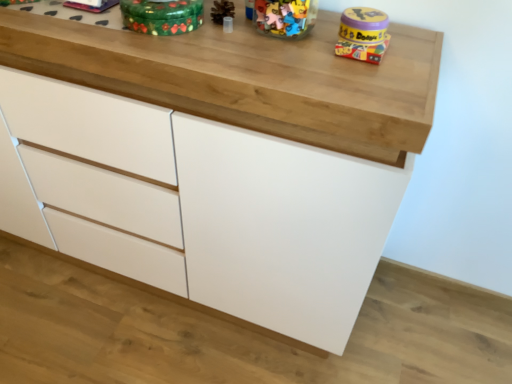
The image size is (512, 384). I want to click on free location to the right of green painted wood toy at upper center, which ranks as the first toy in left-to-right order, so click(x=238, y=44).